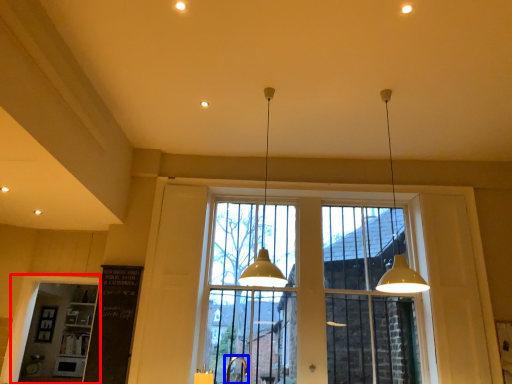
Question: Which of the following is the farthest to the observer, window frame (highlighted by a red box) or faucet (highlighted by a blue box)?

Choices:
 (A) window frame
 (B) faucet

Answer: (A)